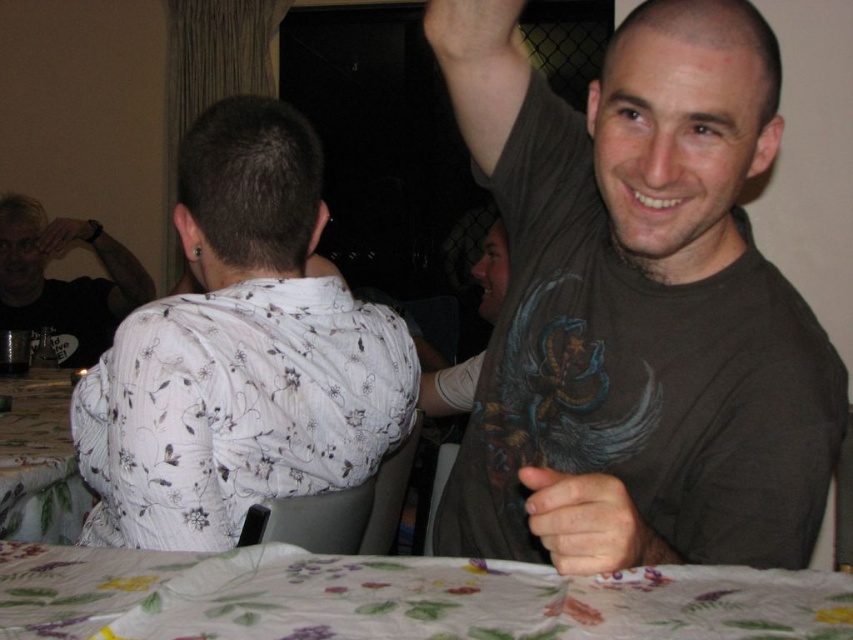
Is floral fabric tablecloth at lower left shorter than matte skin at upper center?

Incorrect, floral fabric tablecloth at lower left's height does not fall short of matte skin at upper center's.

Who is lower down, floral fabric tablecloth at lower left or matte skin at upper center?

floral fabric tablecloth at lower left is lower down.

Looking at this image, measure the distance between point (33, 464) and camera.

The distance of point (33, 464) from camera is 4.28 feet.

Locate an element on the screen. floral fabric tablecloth at lower left is located at coordinates (39, 461).

Does dark brown t-shirt at upper right appear on the left side of matte black shirt at left?

No, dark brown t-shirt at upper right is not to the left of matte black shirt at left.

Who is more forward, (x=775, y=83) or (x=24, y=324)?

Positioned in front is point (x=775, y=83).

Between point (526, 115) and point (88, 234), which one is positioned in front?

Point (526, 115) is in front.

The height and width of the screenshot is (640, 853). What are the coordinates of `dark brown t-shirt at upper right` in the screenshot? It's located at (642, 314).

Is white floral shirt at upper left positioned behind matte black shirt at left?

No, white floral shirt at upper left is in front of matte black shirt at left.

Does point (335, 326) lie behind point (97, 355)?

No, it is in front of (97, 355).

Image resolution: width=853 pixels, height=640 pixels. What do you see at coordinates (241, 353) in the screenshot? I see `white floral shirt at upper left` at bounding box center [241, 353].

Where is `white floral shirt at upper left`? white floral shirt at upper left is located at coordinates (241, 353).